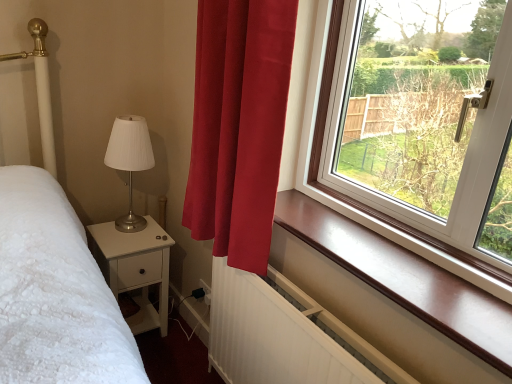
Question: Is white matte nightstand at lower left in front of matte silver table lamp at left?

Choices:
 (A) yes
 (B) no

Answer: (B)

Question: Does white matte nightstand at lower left have a lesser width compared to matte silver table lamp at left?

Choices:
 (A) yes
 (B) no

Answer: (B)

Question: Is white matte nightstand at lower left completely or partially outside of matte silver table lamp at left?

Choices:
 (A) yes
 (B) no

Answer: (A)

Question: Is white matte nightstand at lower left not near matte silver table lamp at left?

Choices:
 (A) yes
 (B) no

Answer: (B)

Question: Can you see white matte nightstand at lower left touching matte silver table lamp at left?

Choices:
 (A) yes
 (B) no

Answer: (B)

Question: Considering the positions of satin red curtain at center and white textured radiator at lower center in the image, is satin red curtain at center wider or thinner than white textured radiator at lower center?

Choices:
 (A) thin
 (B) wide

Answer: (B)

Question: In the image, is satin red curtain at center positioned in front of or behind white textured radiator at lower center?

Choices:
 (A) front
 (B) behind

Answer: (B)

Question: Visually, is satin red curtain at center positioned to the left or to the right of white textured radiator at lower center?

Choices:
 (A) right
 (B) left

Answer: (B)

Question: Is satin red curtain at center taller or shorter than white textured radiator at lower center?

Choices:
 (A) tall
 (B) short

Answer: (A)

Question: Choose the correct answer: Is brown polished wood at upper right inside matte silver table lamp at left or outside it?

Choices:
 (A) outside
 (B) inside

Answer: (A)

Question: Considering the positions of brown polished wood at upper right and matte silver table lamp at left in the image, is brown polished wood at upper right wider or thinner than matte silver table lamp at left?

Choices:
 (A) wide
 (B) thin

Answer: (B)

Question: Considering the positions of brown polished wood at upper right and matte silver table lamp at left in the image, is brown polished wood at upper right bigger or smaller than matte silver table lamp at left?

Choices:
 (A) big
 (B) small

Answer: (B)

Question: Is brown polished wood at upper right taller or shorter than matte silver table lamp at left?

Choices:
 (A) tall
 (B) short

Answer: (B)

Question: Considering the positions of point (125, 137) and point (375, 337), is point (125, 137) closer or farther from the camera than point (375, 337)?

Choices:
 (A) closer
 (B) farther

Answer: (B)

Question: Choose the correct answer: Is matte silver table lamp at left inside brown polished wood at upper right or outside it?

Choices:
 (A) inside
 (B) outside

Answer: (B)